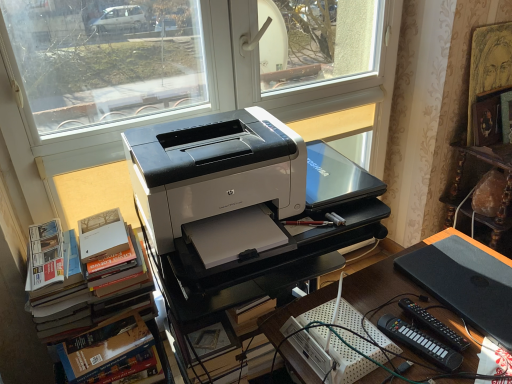
The image size is (512, 384). What are the coordinates of `vacant area that lies between black matte laptop at lower right and black plastic remote control at lower right, acting as the 1th equipment starting from the left` in the screenshot? It's located at (432, 321).